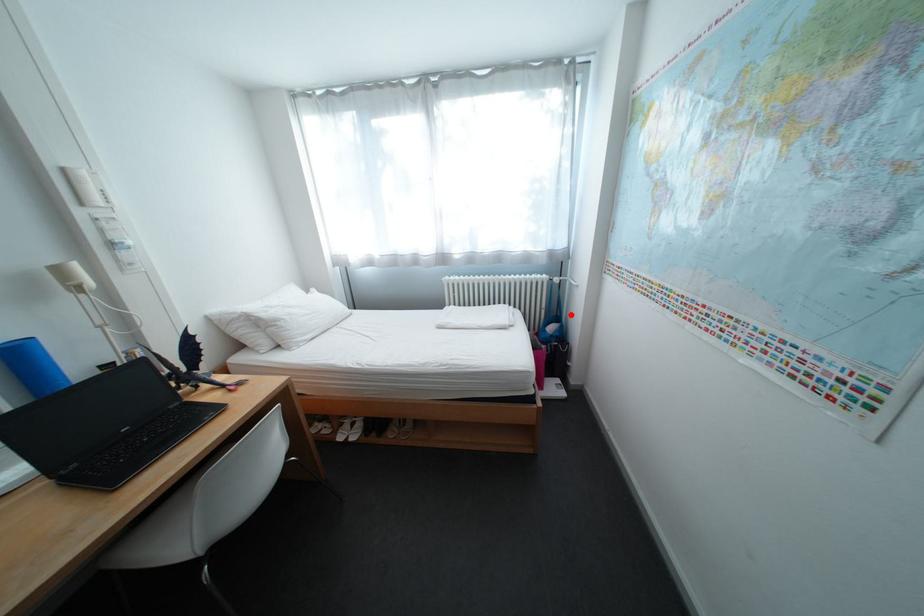
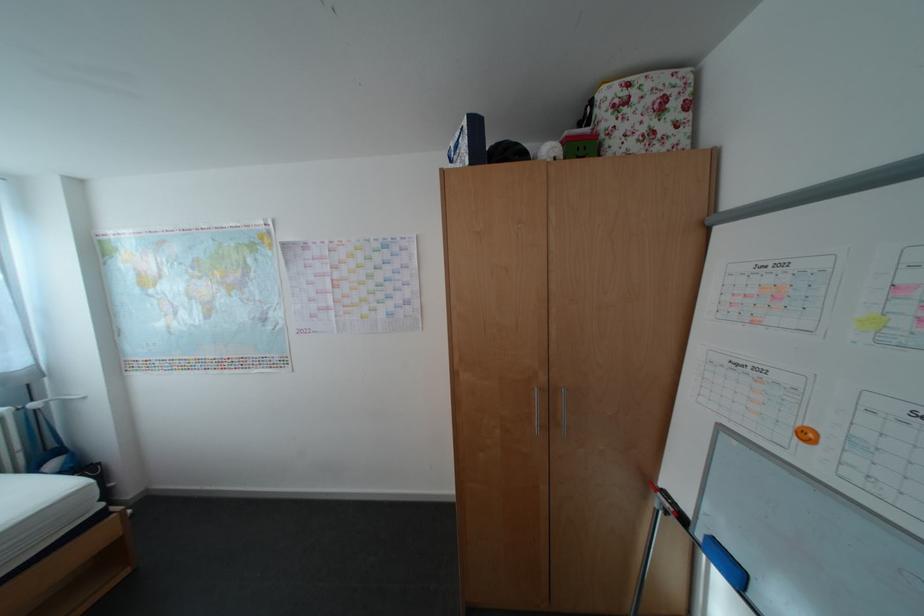
In the second image, find the point that corresponds to the highlighted location in the first image.

(67, 447)